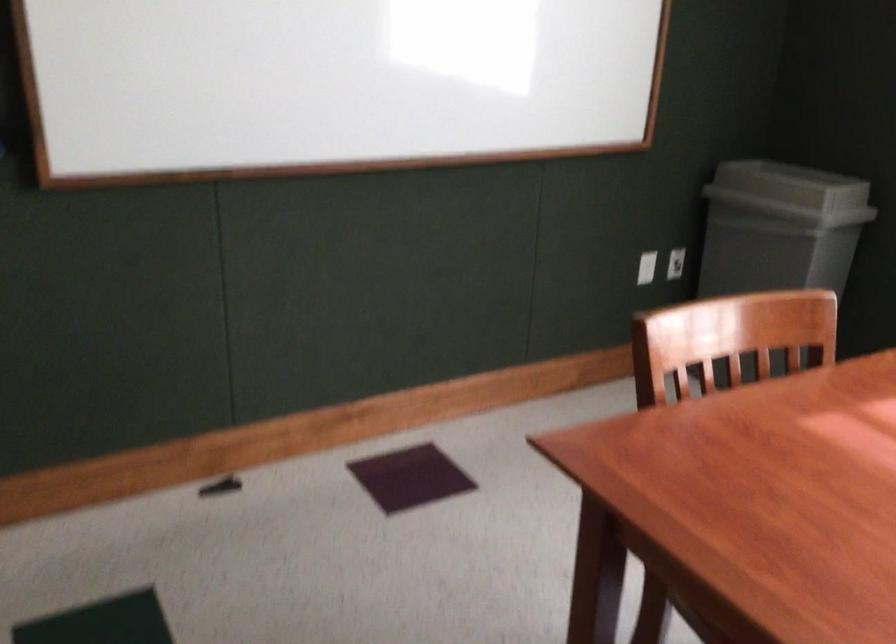
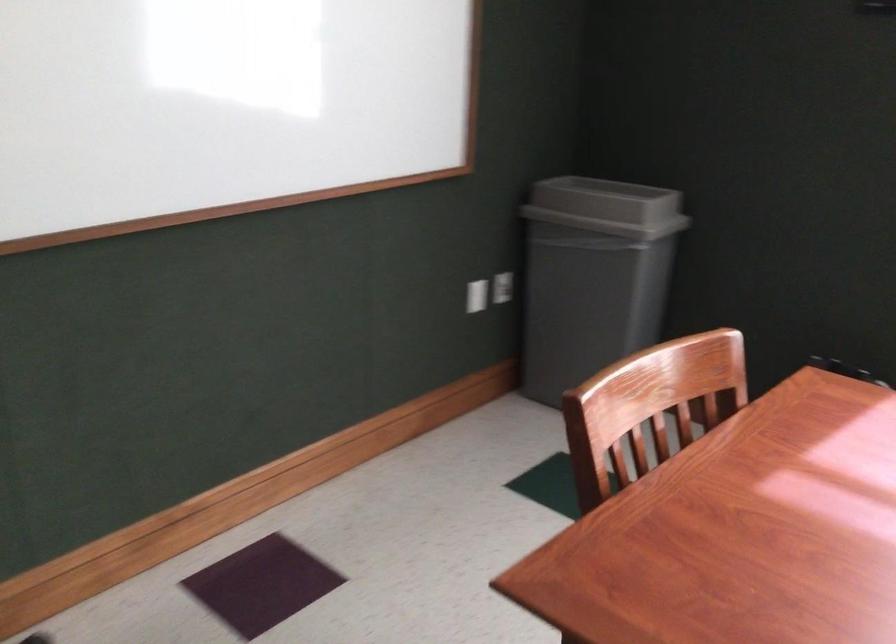
Find the pixel in the second image that matches (679,259) in the first image.

(503, 287)